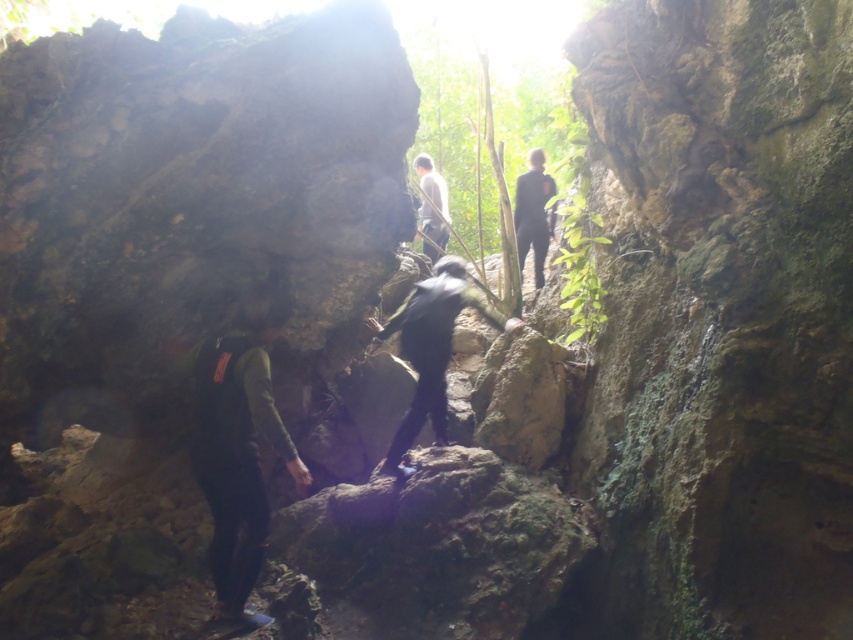
Question: Can you confirm if dark green fabric backpack at lower left is positioned to the right of dark gray fabric jacket at center?

Choices:
 (A) no
 (B) yes

Answer: (A)

Question: Which of the following is the closest to the observer?

Choices:
 (A) dark green fabric backpack at lower left
 (B) black matte climbing gear at center
 (C) black matte jacket at center
 (D) dark gray fabric jacket at center

Answer: (A)

Question: Which point is farther from the camera taking this photo?

Choices:
 (A) (405, 429)
 (B) (442, 212)
 (C) (221, 621)
 (D) (523, 256)

Answer: (B)

Question: Can you confirm if dark green fabric backpack at lower left is smaller than black matte jacket at center?

Choices:
 (A) no
 (B) yes

Answer: (A)

Question: Is black matte jacket at center smaller than dark gray fabric jacket at center?

Choices:
 (A) yes
 (B) no

Answer: (A)

Question: Among these objects, which one is nearest to the camera?

Choices:
 (A) dark green fabric backpack at lower left
 (B) black matte jacket at center

Answer: (A)